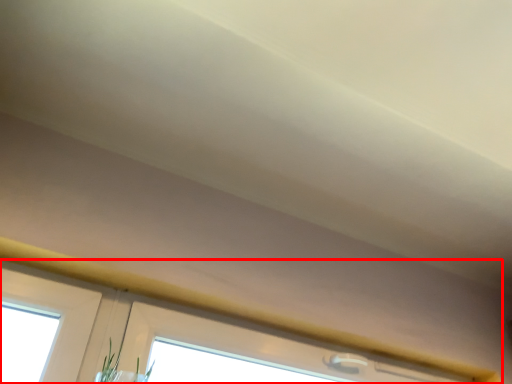
Question: Observing the image, what is the correct spatial positioning of window (annotated by the red box) in reference to plant?

Choices:
 (A) left
 (B) right

Answer: (B)